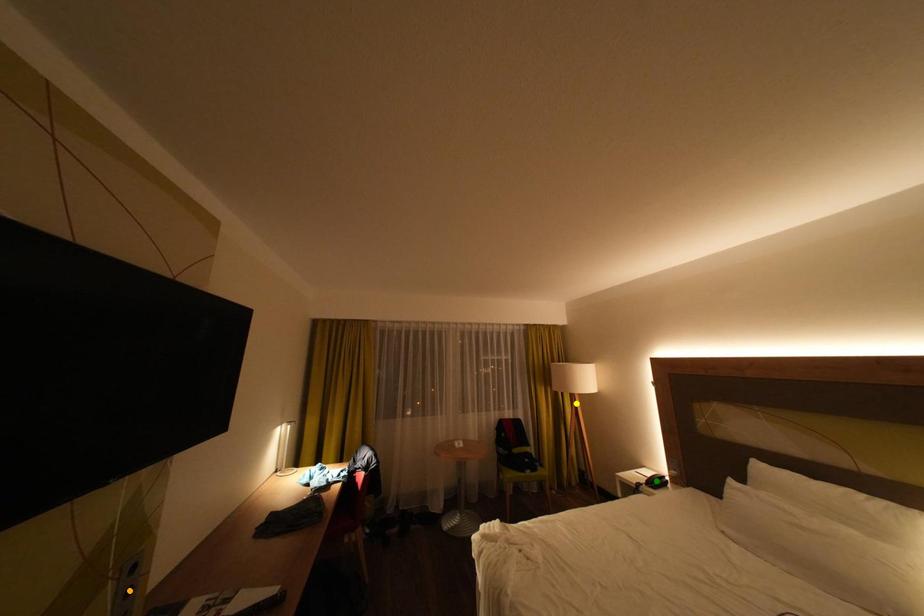
Order these from nearest to farthest:
1. orange point
2. green point
3. yellow point

orange point → green point → yellow point